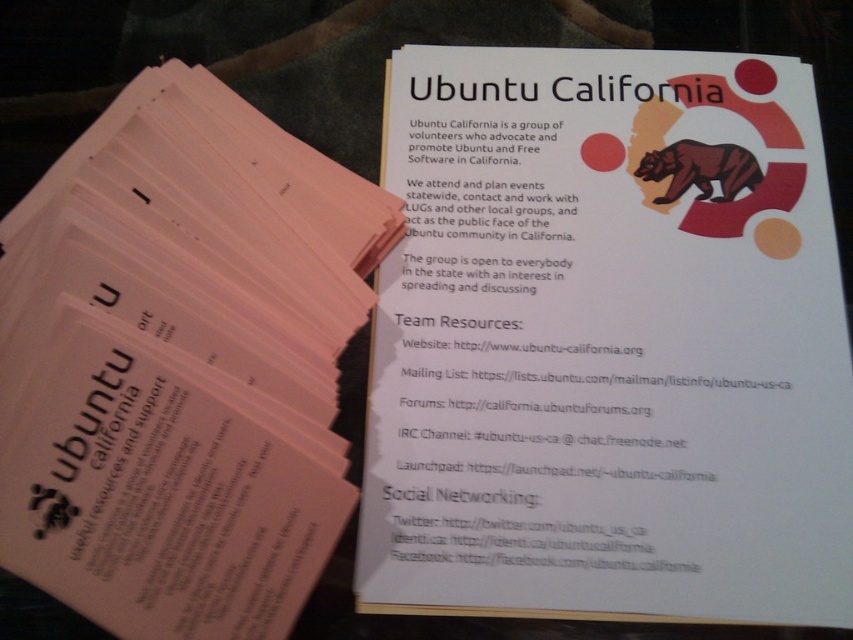
You are organizing documents on a desk and need to place both the white paper at upper center and the pink paper flyer at upper left. Since you want to ensure the wider document is on the left side, which document should you place where?

The white paper at upper center should be placed on the left side because its width surpasses that of the pink paper flyer at upper left, making it wider and thus suitable for the left position.

You are organizing a community event and need to display two items on a table. You have a white paper at upper center and a pink paper flyer at upper left. Which one should you choose if you want to place a larger sign on top of it?

The white paper at upper center is bigger than the pink paper flyer at upper left, so you should choose the white paper at upper center to place the larger sign on top of it.